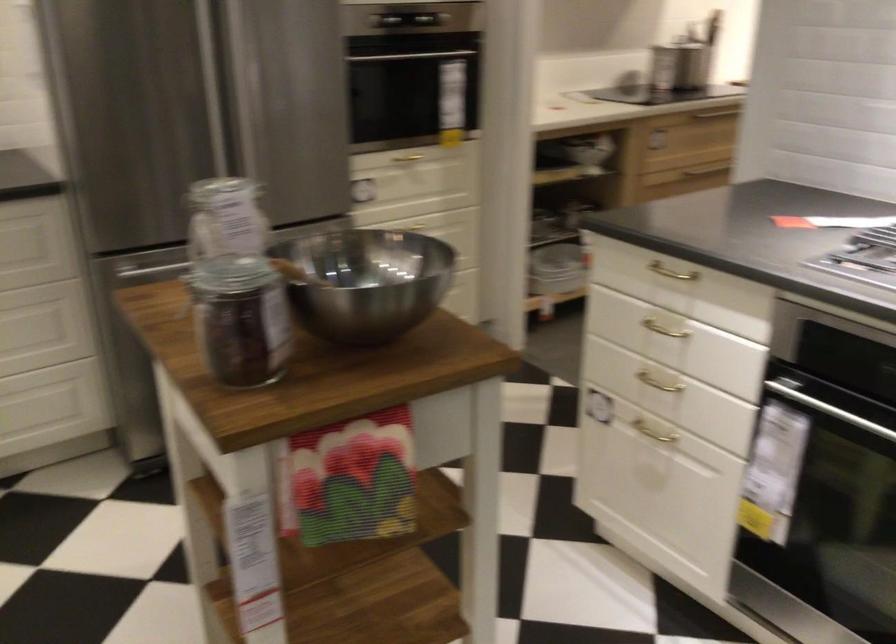
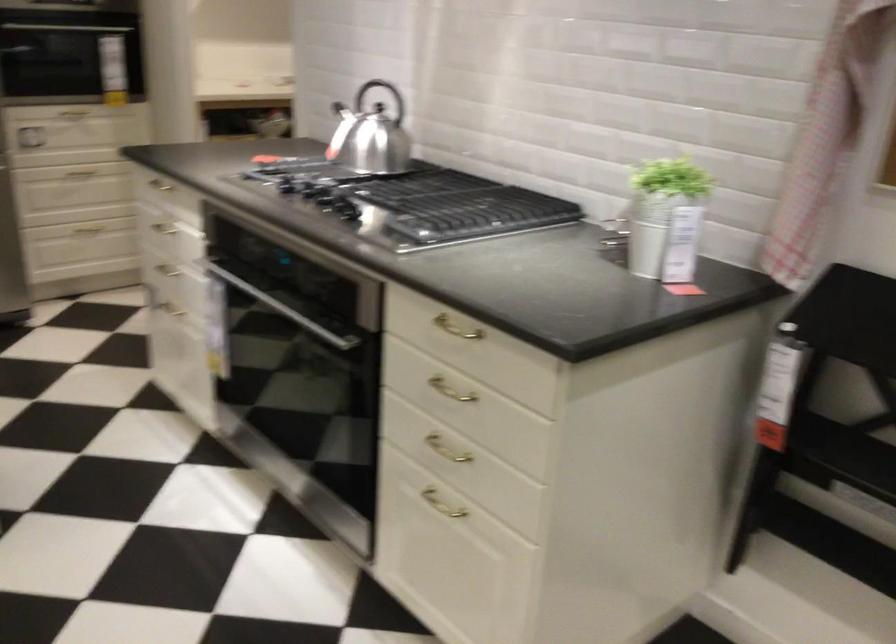
Question: I am providing you with two images of the same scene from different viewpoints. After the viewpoint changes to image2, which objects are now occluded?

Choices:
 (A) chair sitting surface
 (B) kettle handle
 (C) white paper pack
 (D) cabinet handle

Answer: (D)